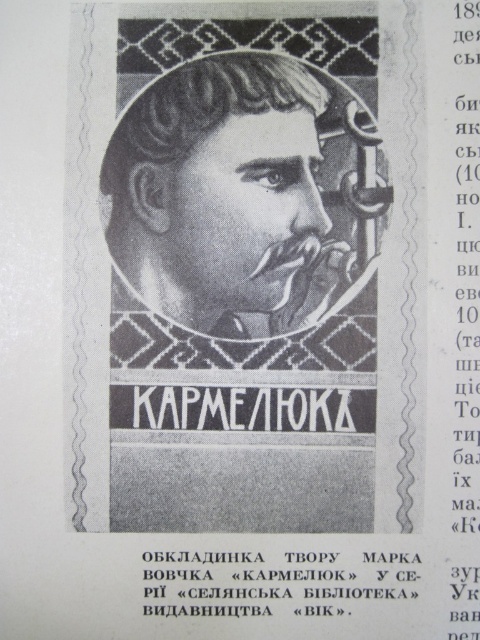
In the scene shown: How far apart are gray pencil sketch of man at center and black paper text at center?

15.20 inches

Between point (170, 304) and point (337, 573), which one is positioned in front?

Point (337, 573) is more forward.

This screenshot has width=480, height=640. I want to click on gray pencil sketch of man at center, so click(x=222, y=195).

You are a GUI agent. You are given a task and a screenshot of the screen. Output one action in this format:
    pyautogui.click(x=<x>, y=<y>)
    Task: Click on the gray pencil sketch of man at center
    The height and width of the screenshot is (640, 480).
    Given the screenshot: What is the action you would take?
    pyautogui.click(x=222, y=195)

Does black paper text at upper center appear over white textured text at center?

Indeed, black paper text at upper center is positioned over white textured text at center.

Does black paper text at upper center appear on the left side of white textured text at center?

No, black paper text at upper center is not to the left of white textured text at center.

At what (x,y) coordinates should I click in order to perform the action: click on black paper text at upper center. Please return your answer as a coordinate pair (x, y). This screenshot has height=640, width=480. Looking at the image, I should click on (463, 308).

Which is more to the left, black paper text at upper center or black paper text at center?

black paper text at center

Does point (464, 483) lie in front of point (156, 561)?

No.

Where is `black paper text at upper center`? black paper text at upper center is located at coordinates (463, 308).